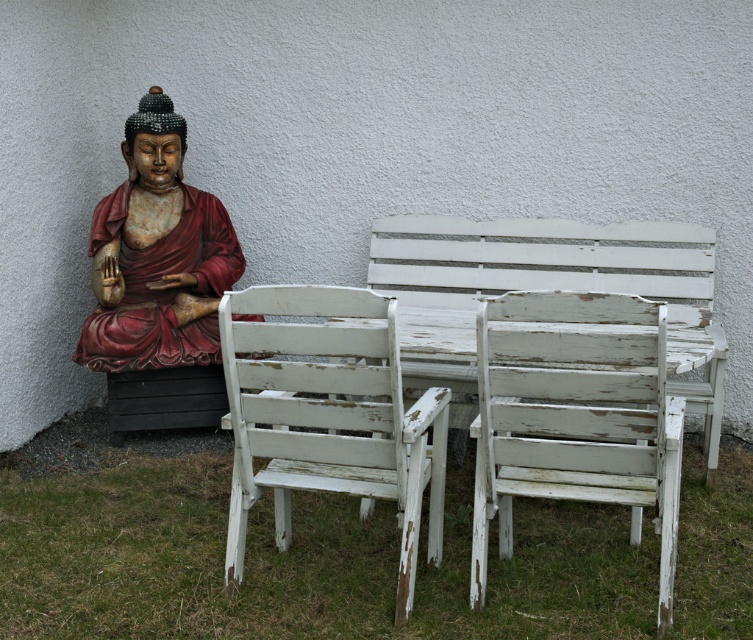
Question: Can you confirm if white chipped paint chair at center is positioned to the right of wooden statue at left?

Choices:
 (A) yes
 (B) no

Answer: (A)

Question: Is white chipped paint chair at center bigger than wooden statue at left?

Choices:
 (A) no
 (B) yes

Answer: (B)

Question: Which object appears farthest from the camera in this image?

Choices:
 (A) white chipped paint chair at center
 (B) white chipped paint table at center
 (C) distressed white wood chair at center

Answer: (B)

Question: Which object is farther from the camera taking this photo?

Choices:
 (A) distressed white wood chair at center
 (B) white chipped paint chair at center
 (C) wooden statue at left
 (D) white chipped paint table at center

Answer: (C)

Question: Is distressed white wood chair at center above wooden statue at left?

Choices:
 (A) no
 (B) yes

Answer: (A)

Question: Which of the following is the closest to the observer?

Choices:
 (A) (434, 368)
 (B) (564, 340)

Answer: (B)